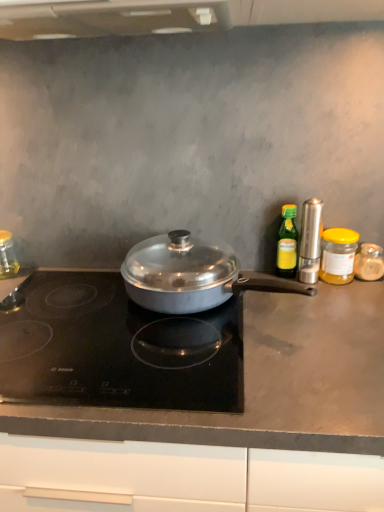
Identify the location of empty space that is ontop of matte gray countertop at center (from a real-world perspective). (216, 344).